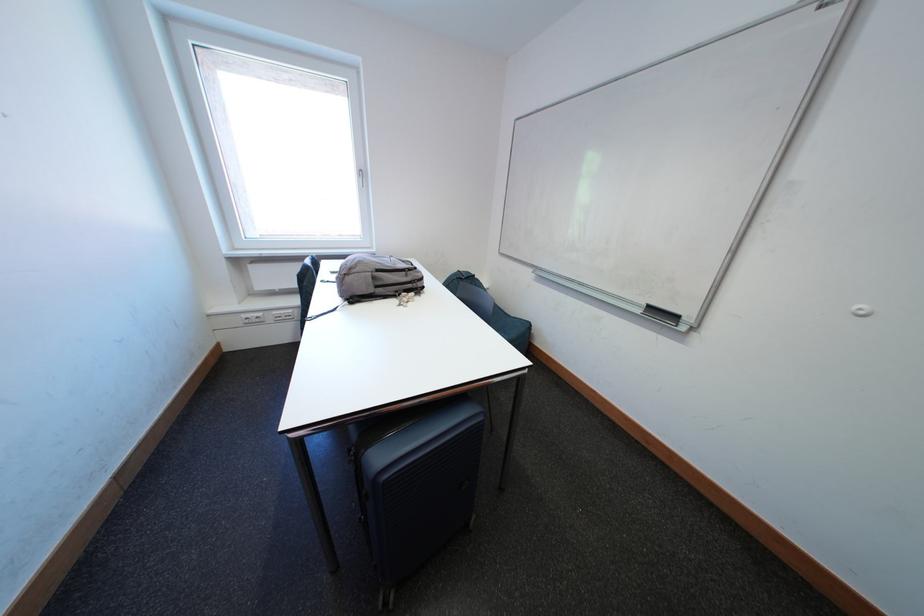
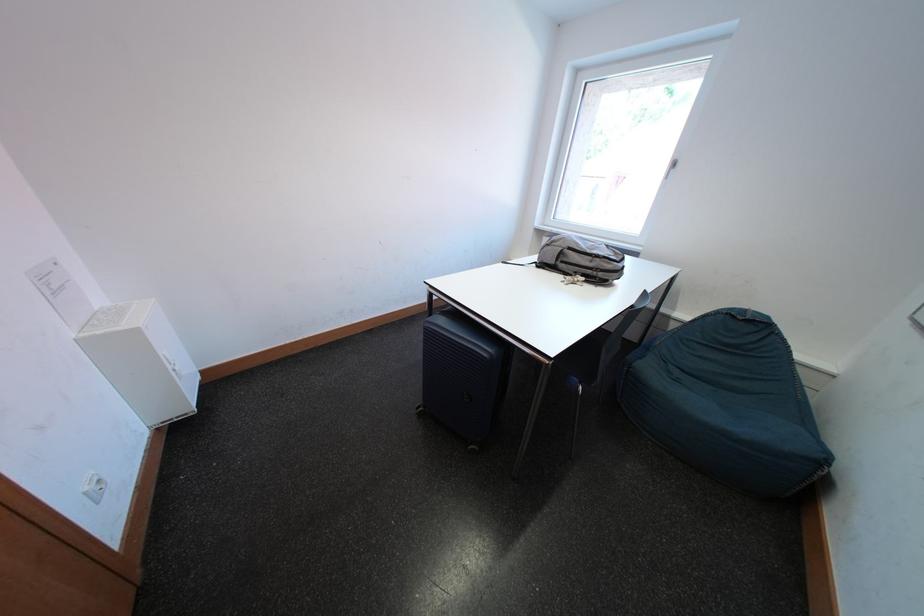
In the second image, find the point that corresponds to point (416, 280) in the first image.

(601, 265)